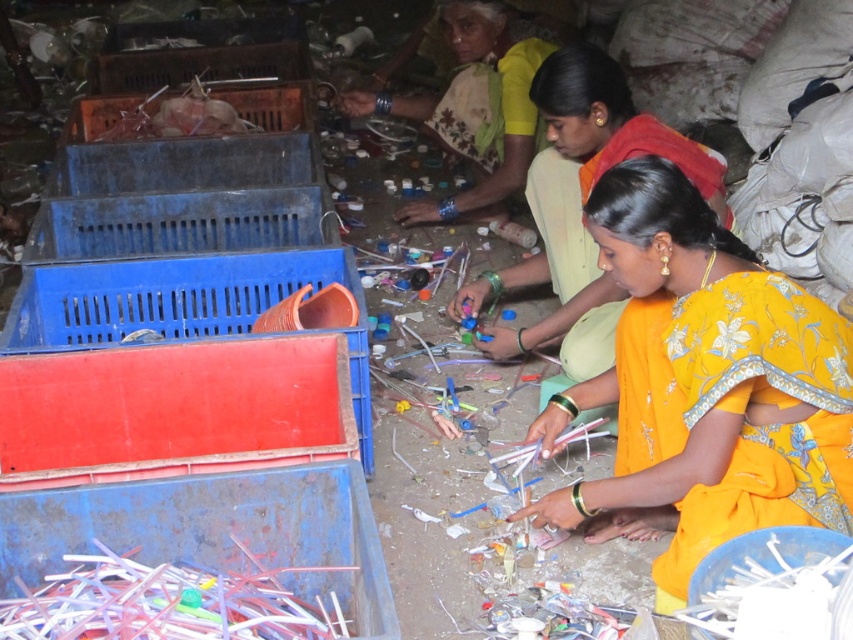
You are a visitor at this recycling center and want to take a photo of both the yellow embroidered sari at center and the green floral sari at center. Which one should you focus on first to ensure both are in the frame?

You should focus on the yellow embroidered sari at center first because it is closer to you than the green floral sari at center, so adjusting the camera to include both would require ensuring the closer one is framed first.

You are a visitor observing the recycling process. You notice the yellow embroidered saree at center and the red plastic crate at lower left. Which object is positioned higher in the image?

The yellow embroidered saree at center is located above the red plastic crate at lower left, so it is positioned higher in the image.